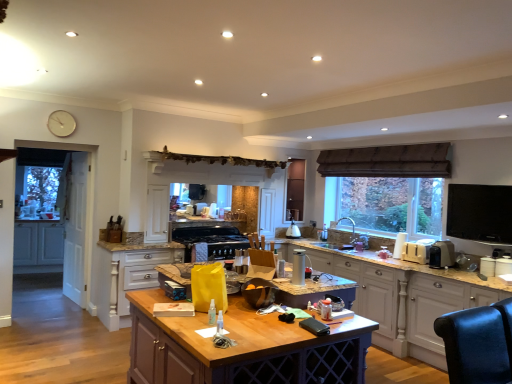
How much space does silver metallic thermos at center, marked as the third appliance in a right-to-left arrangement, occupy horizontally?

The width of silver metallic thermos at center, marked as the third appliance in a right-to-left arrangement, is 4.48 inches.

What do you see at coordinates (242, 348) in the screenshot? I see `wooden table at center` at bounding box center [242, 348].

In order to face black glass stove at center, which is counted as the 1th appliance, starting from the left, should I rotate leftwards or rightwards?

Rotate left and turn 5.215 degrees.

What is the approximate height of black glass stove at center, placed as the 4th appliance when sorted from right to left?

It is 7.30 inches.

Measure the distance between point (62, 114) and camera.

Point (62, 114) and camera are 5.23 meters apart from each other.

The image size is (512, 384). What do you see at coordinates (75, 227) in the screenshot?
I see `white wooden door at left, which is counted as the first screen door, starting from the back` at bounding box center [75, 227].

What are the coordinates of `white wooden door at left, which is counted as the first screen door, starting from the back` in the screenshot? It's located at (75, 227).

At what (x,y) coordinates should I click in order to perform the action: click on white wooden screen door at left, the second screen door positioned from the back. Please return your answer as a coordinate pair (x, y). This screenshot has width=512, height=384. Looking at the image, I should click on pyautogui.click(x=75, y=225).

Is point (188, 237) positioned after point (333, 152)?

No, it is in front of (333, 152).

Is black glass stove at center, placed as the 4th appliance when sorted from right to left, taller than brown fabric exhaust hood at upper center?

No.

Is black glass stove at center, the 4th appliance viewed from the front, aimed at brown fabric exhaust hood at upper center?

No.

Are black glass stove at center, acting as the first appliance starting from the back, and brown fabric exhaust hood at upper center far apart?

black glass stove at center, acting as the first appliance starting from the back, is far away from brown fabric exhaust hood at upper center.

Is white plastic toaster at right, marked as the 2th appliance in a back-to-front arrangement, in front of white wooden door at left, which is counted as the first screen door, starting from the back?

Yes, white plastic toaster at right, marked as the 2th appliance in a back-to-front arrangement, is closer to the camera.

Find the location of a particular element. This screenshot has width=512, height=384. the 2nd appliance in front of the white wooden door at left, which is counted as the first screen door, starting from the back is located at coordinates (417, 251).

From the image's perspective, is white plastic toaster at right, which is the 3th appliance in left-to-right order, on white wooden door at left, marked as the second screen door in a front-to-back arrangement?

Actually, white plastic toaster at right, which is the 3th appliance in left-to-right order, appears below white wooden door at left, marked as the second screen door in a front-to-back arrangement, in the image.

In the scene shown: Does white plastic toaster at right, which is the 2th appliance in right-to-left order, appear on the right side of white wooden door at left, which is counted as the first screen door, starting from the back?

Correct, you'll find white plastic toaster at right, which is the 2th appliance in right-to-left order, to the right of white wooden door at left, which is counted as the first screen door, starting from the back.

From the image's perspective, is white matte clock at upper left on top of white plastic toaster at right, marked as the 2th appliance in a back-to-front arrangement?

Yes.

Consider the image. Does white matte clock at upper left appear on the right side of white plastic toaster at right, which is the 2th appliance in right-to-left order?

No, white matte clock at upper left is not to the right of white plastic toaster at right, which is the 2th appliance in right-to-left order.

Is white matte clock at upper left looking in the opposite direction of white plastic toaster at right, which is the third appliance from front to back?

No, white matte clock at upper left is not facing away from white plastic toaster at right, which is the third appliance from front to back.

Is white matte clock at upper left placed right next to white plastic toaster at right, which is the 3th appliance in left-to-right order?

white matte clock at upper left and white plastic toaster at right, which is the 3th appliance in left-to-right order, are clearly separated.

How far apart are white wooden screen door at left, the second screen door positioned from the back, and silver metallic thermos at center, which is the 4th appliance in back-to-front order?

3.98 meters.

Which is correct: white wooden screen door at left, the first screen door from the front, is inside silver metallic thermos at center, which appears as the second appliance when viewed from the left, or outside of it?

white wooden screen door at left, the first screen door from the front, is not enclosed by silver metallic thermos at center, which appears as the second appliance when viewed from the left.

From a real-world perspective, is white wooden screen door at left, the first screen door from the front, physically above silver metallic thermos at center, the first appliance from the front?

Incorrect, from a real-world perspective, white wooden screen door at left, the first screen door from the front, is lower than silver metallic thermos at center, the first appliance from the front.

Is silver metallic thermos at center, the first appliance from the front, at the back of white wooden screen door at left, the second screen door positioned from the back?

No, white wooden screen door at left, the second screen door positioned from the back, is not facing the opposite direction of silver metallic thermos at center, the first appliance from the front.

Between white wooden screen door at left, the second screen door positioned from the back, and black plastic toaster at right, acting as the second appliance starting from the front, which one has larger width?

black plastic toaster at right, acting as the second appliance starting from the front.

From the image's perspective, relative to black plastic toaster at right, the 4th appliance in the left-to-right sequence, is white wooden screen door at left, the second screen door positioned from the back, above or below?

white wooden screen door at left, the second screen door positioned from the back, is above black plastic toaster at right, the 4th appliance in the left-to-right sequence.

This screenshot has height=384, width=512. Identify the location of screen door that is the 1st object directly below the black plastic toaster at right, the third appliance viewed from the back (from a real-world perspective). (75, 225).

At what (x,y) coordinates should I click in order to perform the action: click on cabinetry that is the 2nd object located below the white plastic toaster at right, marked as the 2th appliance in a back-to-front arrangement (from the image's perspective). Please return your answer as a coordinate pair (x, y). The height and width of the screenshot is (384, 512). Looking at the image, I should click on (129, 275).

Which is more to the left, white wood drawers at center, which is the second cabinetry from right to left, or white plastic toaster at right, which is the third appliance from front to back?

Positioned to the left is white wood drawers at center, which is the second cabinetry from right to left.

How far apart are white wood drawers at center, the second cabinetry in the left-to-right sequence, and white plastic toaster at right, which is the 2th appliance in right-to-left order?

They are 2.99 meters apart.

From the image's perspective, who appears lower, white wood drawers at center, the second cabinetry from the back, or white plastic toaster at right, marked as the 2th appliance in a back-to-front arrangement?

white wood drawers at center, the second cabinetry from the back, appears lower in the image.

Is matte white cabinets at left, which appears as the 3th cabinetry when viewed from the right, not close to wooden table at center?

Yes, matte white cabinets at left, which appears as the 3th cabinetry when viewed from the right, and wooden table at center are quite far apart.

Can you confirm if matte white cabinets at left, which appears as the 3th cabinetry when viewed from the right, is positioned to the right of wooden table at center?

No.

Which is in front, point (22, 263) or point (290, 366)?

The point (290, 366) is closer to the camera.

This screenshot has width=512, height=384. What are the coordinates of `exhaust hood in front of the black glass stove at center, placed as the 4th appliance when sorted from right to left` in the screenshot? It's located at (388, 161).

Locate an element on the screen. Image resolution: width=512 pixels, height=384 pixels. screen door that is the 2nd one when counting backward from the white plastic toaster at right, which is the third appliance from front to back is located at coordinates (75, 227).

When comparing their distances from silver metallic thermos at center, which is the 4th appliance in back-to-front order, does white wooden door at left, which is counted as the first screen door, starting from the back, or white plastic toaster at right, which is the 2th appliance in right-to-left order, seem closer?

white plastic toaster at right, which is the 2th appliance in right-to-left order, is positioned closer to the anchor silver metallic thermos at center, which is the 4th appliance in back-to-front order.

Looking at the image, which one is located further to silver metallic thermos at center, the first appliance from the front, white wood drawers at center, which is the second cabinetry from right to left, or black plastic toaster at right, acting as the second appliance starting from the front?

white wood drawers at center, which is the second cabinetry from right to left, is positioned further to the anchor silver metallic thermos at center, the first appliance from the front.

Based on their spatial positions, is silver metallic thermos at center, the first appliance from the front, or brown fabric exhaust hood at upper center further from white wood cabinetry at right, the 1th cabinetry when ordered from right to left?

Among the two, silver metallic thermos at center, the first appliance from the front, is located further to white wood cabinetry at right, the 1th cabinetry when ordered from right to left.

Considering their positions, is black plastic toaster at right, which is the first appliance in right-to-left order, positioned further to black glass stove at center, acting as the first appliance starting from the back, than brown fabric exhaust hood at upper center?

Among the two, black plastic toaster at right, which is the first appliance in right-to-left order, is located further to black glass stove at center, acting as the first appliance starting from the back.

Considering their positions, is black plastic toaster at right, the third appliance viewed from the back, positioned further to brown fabric exhaust hood at upper center than matte white cabinets at left, which appears as the 3th cabinetry when viewed from the right?

matte white cabinets at left, which appears as the 3th cabinetry when viewed from the right, is further to brown fabric exhaust hood at upper center.

Considering their positions, is matte white cabinets at left, which is the 3th cabinetry in front-to-back order, positioned further to white wood cabinetry at right, which is the 3th cabinetry from left to right, than white plastic toaster at right, which is the 2th appliance in right-to-left order?

Based on the image, matte white cabinets at left, which is the 3th cabinetry in front-to-back order, appears to be further to white wood cabinetry at right, which is the 3th cabinetry from left to right.

Considering their positions, is white matte clock at upper left positioned closer to wooden table at center than white wooden screen door at left, the second screen door positioned from the back?

Among the two, white wooden screen door at left, the second screen door positioned from the back, is located nearer to wooden table at center.

From the image, which object appears to be farther from white wood drawers at center, which is the second cabinetry from right to left, white wooden screen door at left, the second screen door positioned from the back, or white wood cabinetry at right, placed as the third cabinetry when sorted from back to front?

Among the two, white wood cabinetry at right, placed as the third cabinetry when sorted from back to front, is located further to white wood drawers at center, which is the second cabinetry from right to left.

Find the location of a particular element. screen door between white wooden screen door at left, the second screen door positioned from the back, and white wood drawers at center, which appears as the second cabinetry when viewed from the front, from left to right is located at coordinates (75, 227).

In order to click on table between white wood drawers at center, which is the second cabinetry from right to left, and black plastic toaster at right, which is the first appliance in right-to-left order in this screenshot , I will do `click(242, 348)`.

The image size is (512, 384). What are the coordinates of `clock positioned between wooden table at center and white wooden door at left, which is counted as the first screen door, starting from the back, from near to far` in the screenshot? It's located at (61, 123).

I want to click on exhaust hood between white wooden screen door at left, the second screen door positioned from the back, and black plastic toaster at right, which is the first appliance in right-to-left order, in the horizontal direction, so click(x=388, y=161).